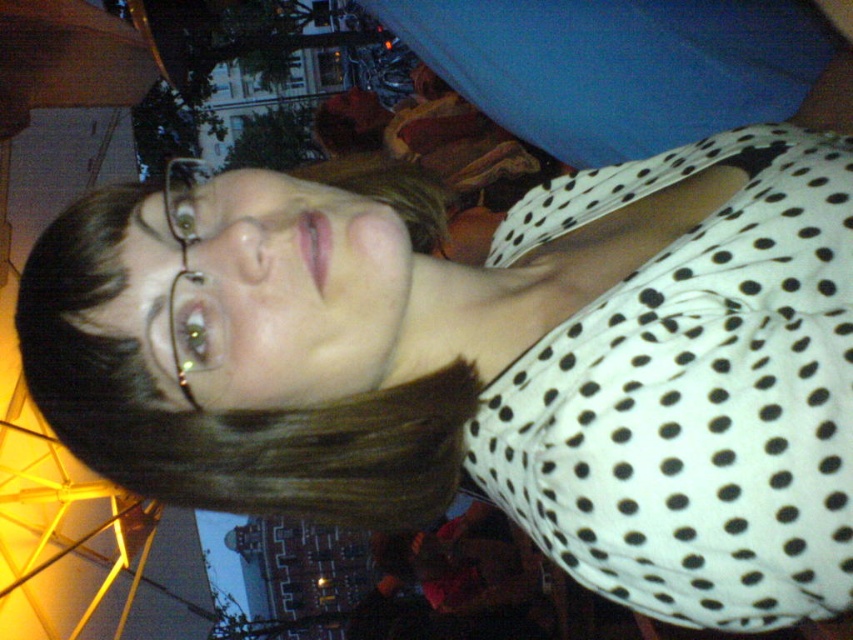
Question: Can you confirm if white dotted fabric at center is positioned to the right of clear plastic glasses at upper left?

Choices:
 (A) no
 (B) yes

Answer: (B)

Question: Estimate the real-world distances between objects in this image. Which object is closer to the brown smooth hair at upper left?

Choices:
 (A) clear plastic glasses at upper left
 (B) white dotted fabric at center

Answer: (B)

Question: Which of the following is the closest to the observer?

Choices:
 (A) (239, 413)
 (B) (585, 186)

Answer: (A)

Question: Does brown smooth hair at upper left appear over clear plastic glasses at upper left?

Choices:
 (A) yes
 (B) no

Answer: (B)

Question: Which object is the farthest from the brown smooth hair at upper left?

Choices:
 (A) white dotted fabric at center
 (B) clear plastic glasses at upper left

Answer: (B)

Question: Considering the relative positions of white dotted fabric at center and brown smooth hair at upper left in the image provided, where is white dotted fabric at center located with respect to brown smooth hair at upper left?

Choices:
 (A) left
 (B) right

Answer: (B)